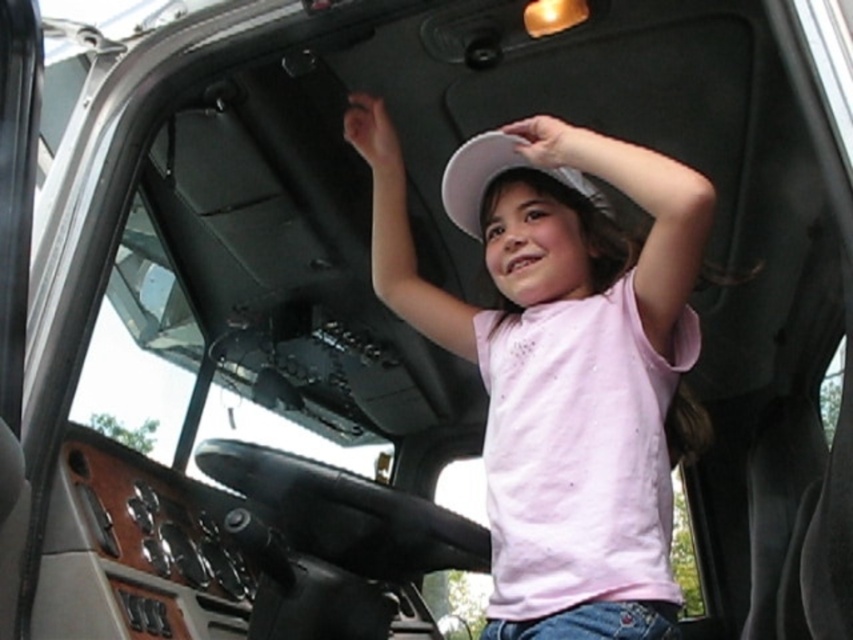
Which of these two, white matte hat at upper center or white matte hat at center, stands shorter?

With less height is white matte hat at center.

Which is in front, point (553, 292) or point (451, 173)?

Positioned in front is point (553, 292).

Image resolution: width=853 pixels, height=640 pixels. Describe the element at coordinates (543, 236) in the screenshot. I see `white matte hat at upper center` at that location.

Locate an element on the screen. The width and height of the screenshot is (853, 640). white matte hat at upper center is located at coordinates (543, 236).